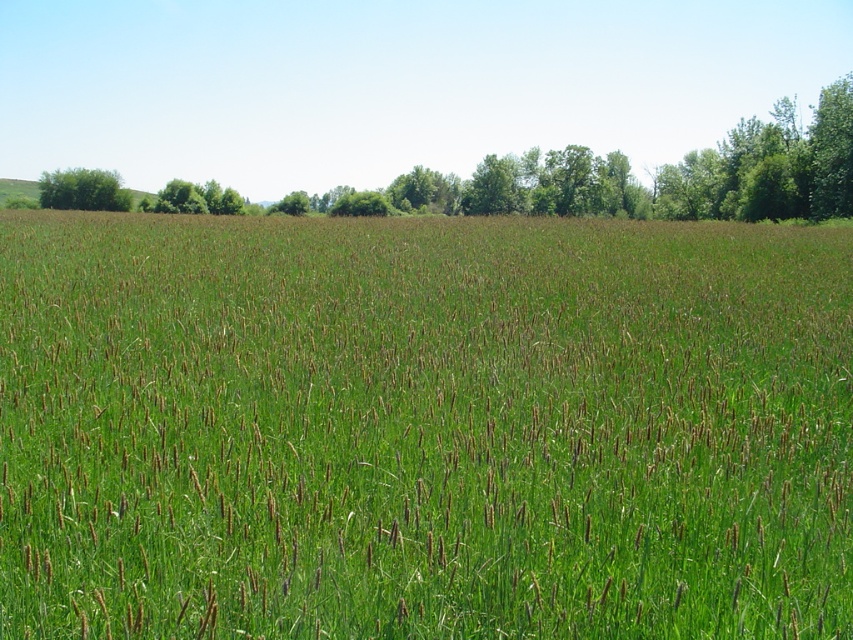
Question: Where is green grassy field at center located in relation to green leafy tree at upper left in the image?

Choices:
 (A) below
 (B) above

Answer: (A)

Question: Can you confirm if green grassy field at center is thinner than green leafy tree at upper left?

Choices:
 (A) no
 (B) yes

Answer: (A)

Question: Which object appears closest to the camera in this image?

Choices:
 (A) green grassy field at center
 (B) green leafy tree at upper left

Answer: (A)

Question: Is green grassy field at center thinner than green leafy tree at upper left?

Choices:
 (A) yes
 (B) no

Answer: (B)

Question: Among these objects, which one is farthest from the camera?

Choices:
 (A) green leafy tree at upper left
 (B) green grassy field at center

Answer: (A)